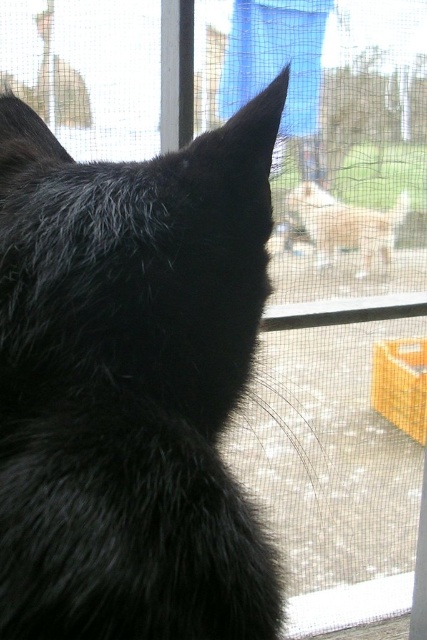
Is screen mesh at upper center in front of white mesh screen at lower center?

Yes, it is.

Between screen mesh at upper center and white mesh screen at lower center, which one is positioned higher?

screen mesh at upper center

Between point (368, 419) and point (391, 579), which one is positioned in front?

Positioned in front is point (391, 579).

Locate an element on the screen. This screenshot has width=427, height=640. screen mesh at upper center is located at coordinates (336, 294).

Between point (350, 236) and point (350, 612), which one is positioned behind?

The point (350, 236) is behind.

Does fuzzy beige dog at center have a smaller size compared to white mesh screen at lower center?

Yes, fuzzy beige dog at center is smaller than white mesh screen at lower center.

Does point (382, 244) come farther from viewer compared to point (339, 618)?

Yes, point (382, 244) is farther from viewer.

Locate an element on the screen. Image resolution: width=427 pixels, height=640 pixels. fuzzy beige dog at center is located at coordinates (347, 225).

Between black fluffy cat at left and fuzzy beige dog at center, which one has more height?

With more height is black fluffy cat at left.

Which is in front, point (157, 200) or point (383, 237)?

Point (157, 200) is in front.

Does point (26, 332) come closer to viewer compared to point (330, 259)?

Yes.

At what (x,y) coordinates should I click in order to perform the action: click on black fluffy cat at left. Please return your answer as a coordinate pair (x, y). Looking at the image, I should click on (131, 384).